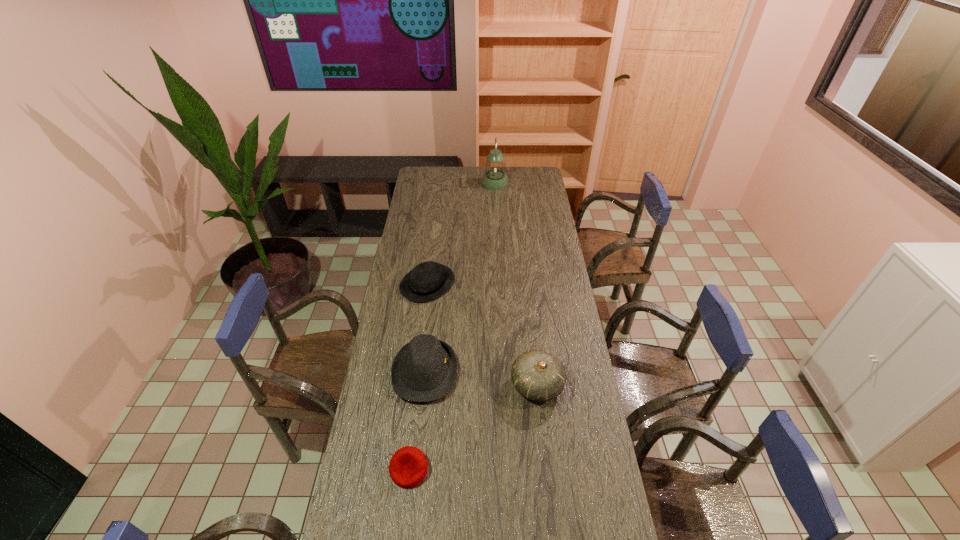
Identify the location of free space between the beanbag and the farthest object. The image size is (960, 540). (452, 326).

At what (x,y) coordinates should I click in order to perform the action: click on free space between the nearest object and the tallest object. Please return your answer as a coordinate pair (x, y). The image size is (960, 540). Looking at the image, I should click on (452, 326).

Where is `vacant area between the fourth shortest object and the beanbag`? vacant area between the fourth shortest object and the beanbag is located at coordinates (473, 428).

At what (x,y) coordinates should I click in order to perform the action: click on free space between the third tallest object and the beanbag. Please return your answer as a coordinate pair (x, y). Looking at the image, I should click on (417, 421).

You are a GUI agent. You are given a task and a screenshot of the screen. Output one action in this format:
    pyautogui.click(x=<x>, y=<y>)
    Task: Click on the vacant region between the farther fedora and the gourd
    
    Given the screenshot: What is the action you would take?
    pyautogui.click(x=482, y=335)

Select which object appears as the closest to the gourd. Please provide its 2D coordinates. Your answer should be formatted as a tuple, i.e. [(x, y)], where the tuple contains the x and y coordinates of a point satisfying the conditions above.

[(424, 370)]

At what (x,y) coordinates should I click in order to perform the action: click on object that is the fourth nearest to the farthest object. Please return your answer as a coordinate pair (x, y). Looking at the image, I should click on 408,467.

Find the location of `free region that satisfies the following two spatial constraints: 1. on the front-facing side of the nearer fedora; 2. on the seat area of the beanbag`. free region that satisfies the following two spatial constraints: 1. on the front-facing side of the nearer fedora; 2. on the seat area of the beanbag is located at coordinates (415, 469).

This screenshot has width=960, height=540. I want to click on free spot that satisfies the following two spatial constraints: 1. on the front-facing side of the third shortest object; 2. on the seat area of the nearest object, so click(x=415, y=469).

Find the location of a particular element. Image resolution: width=960 pixels, height=540 pixels. vacant position in the image that satisfies the following two spatial constraints: 1. on the front-facing side of the third tallest object; 2. on the seat area of the nearest object is located at coordinates (415, 469).